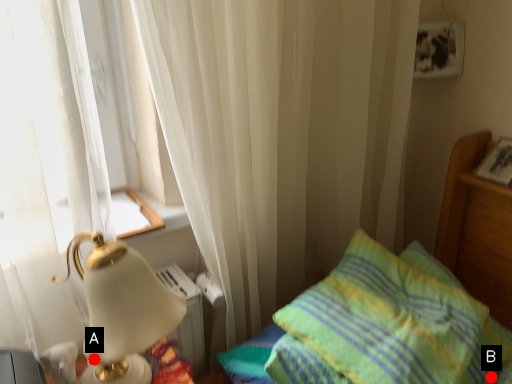
Question: Two points are circled on the image, labeled by A and B beside each circle. Which of the following is the farthest from the observer?

Choices:
 (A) A is further
 (B) B is further

Answer: (B)